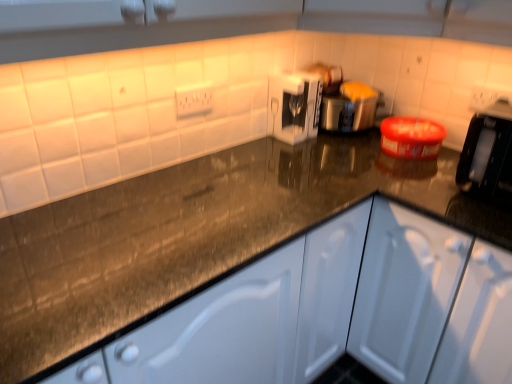
Identify the location of white matte cabinet at center. The width and height of the screenshot is (512, 384). (x=406, y=292).

What do you see at coordinates (350, 108) in the screenshot? I see `satin silver toaster at center, the second appliance in the left-to-right sequence` at bounding box center [350, 108].

Based on the photo, how much space does satin silver toaster at center, the second appliance in the left-to-right sequence, occupy vertically?

satin silver toaster at center, the second appliance in the left-to-right sequence, is 9.99 inches tall.

Find the location of a particular element. The width and height of the screenshot is (512, 384). white plastic electric outlet at upper center is located at coordinates (194, 99).

From a real-world perspective, which object rests below the other?

white matte cabinet at center, from a real-world perspective.

Is satin silver toaster at center, marked as the first appliance in a right-to-left arrangement, looking in the opposite direction of white matte cabinet at center?

No, satin silver toaster at center, marked as the first appliance in a right-to-left arrangement,'s orientation is not away from white matte cabinet at center.

Which object is positioned more to the left, satin silver toaster at center, marked as the first appliance in a right-to-left arrangement, or white matte cabinet at center?

satin silver toaster at center, marked as the first appliance in a right-to-left arrangement.

Would you say satin silver toaster at center, the second appliance in the left-to-right sequence, is inside or outside white matte cabinet at center?

satin silver toaster at center, the second appliance in the left-to-right sequence, cannot be found inside white matte cabinet at center.

Considering the relative positions of white glossy coffee machine at center, which appears as the first appliance when viewed from the left, and white plastic electric outlet at upper center in the image provided, is white glossy coffee machine at center, which appears as the first appliance when viewed from the left, to the right of white plastic electric outlet at upper center from the viewer's perspective?

Correct, you'll find white glossy coffee machine at center, which appears as the first appliance when viewed from the left, to the right of white plastic electric outlet at upper center.

Is white glossy coffee machine at center, which appears as the first appliance when viewed from the left, turned away from white plastic electric outlet at upper center?

No, white plastic electric outlet at upper center is not at the back of white glossy coffee machine at center, which appears as the first appliance when viewed from the left.

Is white glossy coffee machine at center, which appears as the first appliance when viewed from the left, positioned far away from white plastic electric outlet at upper center?

white glossy coffee machine at center, which appears as the first appliance when viewed from the left, is actually quite close to white plastic electric outlet at upper center.

Which object is further away from the camera taking this photo, white glossy coffee machine at center, placed as the second appliance when sorted from right to left, or white plastic electric outlet at upper center?

white glossy coffee machine at center, placed as the second appliance when sorted from right to left, is behind.

From the image's perspective, does white plastic electric outlet at upper center appear lower than white matte cabinet at center?

Incorrect, from the image's perspective, white plastic electric outlet at upper center is higher than white matte cabinet at center.

Does white plastic electric outlet at upper center have a smaller size compared to white matte cabinet at center?

Yes, white plastic electric outlet at upper center is smaller than white matte cabinet at center.

Is white plastic electric outlet at upper center taller or shorter than white matte cabinet at center?

white plastic electric outlet at upper center is shorter than white matte cabinet at center.

How many degrees apart are the facing directions of white plastic electric outlet at upper center and white matte cabinet at center?

87.6 degrees separate the facing orientations of white plastic electric outlet at upper center and white matte cabinet at center.

Does white matte cabinet at center have a smaller size compared to white plastic electric outlet at upper center?

No.

Is white matte cabinet at center to the left of white plastic electric outlet at upper center from the viewer's perspective?

Incorrect, white matte cabinet at center is not on the left side of white plastic electric outlet at upper center.

Is white matte cabinet at center not close to white plastic electric outlet at upper center?

No, white matte cabinet at center is not far from white plastic electric outlet at upper center.

From the image's perspective, who appears lower, white matte cabinet at center or white plastic electric outlet at upper center?

white matte cabinet at center, from the image's perspective.

Looking at this image, is white plastic electric outlet at upper center taller or shorter than white glossy coffee machine at center, which appears as the first appliance when viewed from the left?

white plastic electric outlet at upper center is shorter than white glossy coffee machine at center, which appears as the first appliance when viewed from the left.

Is white plastic electric outlet at upper center situated inside white glossy coffee machine at center, placed as the second appliance when sorted from right to left, or outside?

white plastic electric outlet at upper center cannot be found inside white glossy coffee machine at center, placed as the second appliance when sorted from right to left.

From the image's perspective, who appears lower, white plastic electric outlet at upper center or white glossy coffee machine at center, placed as the second appliance when sorted from right to left?

white plastic electric outlet at upper center.

Which point is more distant from viewer, (183, 111) or (301, 85)?

The point (301, 85) is behind.

From a real-world perspective, is white matte cabinet at center below white glossy coffee machine at center, placed as the second appliance when sorted from right to left?

Correct, in the physical world, white matte cabinet at center is lower than white glossy coffee machine at center, placed as the second appliance when sorted from right to left.

Between white matte cabinet at center and white glossy coffee machine at center, placed as the second appliance when sorted from right to left, which one is positioned behind?

white glossy coffee machine at center, placed as the second appliance when sorted from right to left, is further away from the camera.

Considering the relative sizes of white matte cabinet at center and white glossy coffee machine at center, placed as the second appliance when sorted from right to left, in the image provided, is white matte cabinet at center wider than white glossy coffee machine at center, placed as the second appliance when sorted from right to left,?

Indeed, white matte cabinet at center has a greater width compared to white glossy coffee machine at center, placed as the second appliance when sorted from right to left.

In terms of size, does satin silver toaster at center, marked as the first appliance in a right-to-left arrangement, appear bigger or smaller than white glossy coffee machine at center, placed as the second appliance when sorted from right to left?

satin silver toaster at center, marked as the first appliance in a right-to-left arrangement, is bigger than white glossy coffee machine at center, placed as the second appliance when sorted from right to left.

From the picture: Does satin silver toaster at center, marked as the first appliance in a right-to-left arrangement, have a lesser width compared to white glossy coffee machine at center, which appears as the first appliance when viewed from the left?

No, satin silver toaster at center, marked as the first appliance in a right-to-left arrangement, is not thinner than white glossy coffee machine at center, which appears as the first appliance when viewed from the left.

Is satin silver toaster at center, marked as the first appliance in a right-to-left arrangement, positioned far away from white glossy coffee machine at center, which appears as the first appliance when viewed from the left?

No, satin silver toaster at center, marked as the first appliance in a right-to-left arrangement, is not far from white glossy coffee machine at center, which appears as the first appliance when viewed from the left.

Measure the distance between satin silver toaster at center, marked as the first appliance in a right-to-left arrangement, and white glossy coffee machine at center, which appears as the first appliance when viewed from the left.

The distance of satin silver toaster at center, marked as the first appliance in a right-to-left arrangement, from white glossy coffee machine at center, which appears as the first appliance when viewed from the left, is 4.65 inches.

Starting from the white matte cabinet at center, which appliance is the 1st one to the left? Please provide its 2D coordinates.

[(350, 108)]

Where is `electric outlet above the white glossy coffee machine at center, which appears as the first appliance when viewed from the left (from a real-world perspective)`? Image resolution: width=512 pixels, height=384 pixels. electric outlet above the white glossy coffee machine at center, which appears as the first appliance when viewed from the left (from a real-world perspective) is located at coordinates (194, 99).

From the image, which object appears to be nearer to white glossy coffee machine at center, which appears as the first appliance when viewed from the left, white plastic electric outlet at upper center or satin silver toaster at center, marked as the first appliance in a right-to-left arrangement?

satin silver toaster at center, marked as the first appliance in a right-to-left arrangement, lies closer to white glossy coffee machine at center, which appears as the first appliance when viewed from the left, than the other object.

From the image, which object appears to be nearer to white matte cabinet at center, white plastic electric outlet at upper center or satin silver toaster at center, marked as the first appliance in a right-to-left arrangement?

satin silver toaster at center, marked as the first appliance in a right-to-left arrangement, is closer to white matte cabinet at center.

Looking at the image, which one is located closer to white plastic electric outlet at upper center, white glossy coffee machine at center, placed as the second appliance when sorted from right to left, or white matte cabinet at center?

white glossy coffee machine at center, placed as the second appliance when sorted from right to left, lies closer to white plastic electric outlet at upper center than the other object.

Estimate the real-world distances between objects in this image. Which object is closer to white glossy coffee machine at center, placed as the second appliance when sorted from right to left, white matte cabinet at center or satin silver toaster at center, the second appliance in the left-to-right sequence?

Among the two, satin silver toaster at center, the second appliance in the left-to-right sequence, is located nearer to white glossy coffee machine at center, placed as the second appliance when sorted from right to left.

Based on their spatial positions, is white plastic electric outlet at upper center or white glossy coffee machine at center, placed as the second appliance when sorted from right to left, further from white matte cabinet at center?

white plastic electric outlet at upper center is positioned further to the anchor white matte cabinet at center.

Estimate the real-world distances between objects in this image. Which object is further from white matte cabinet at center, satin silver toaster at center, marked as the first appliance in a right-to-left arrangement, or white plastic electric outlet at upper center?

Based on the image, white plastic electric outlet at upper center appears to be further to white matte cabinet at center.

In the scene shown: When comparing their distances from white plastic electric outlet at upper center, does satin silver toaster at center, the second appliance in the left-to-right sequence, or white glossy coffee machine at center, placed as the second appliance when sorted from right to left, seem closer?

The object closer to white plastic electric outlet at upper center is white glossy coffee machine at center, placed as the second appliance when sorted from right to left.

Based on their spatial positions, is white matte cabinet at center or satin silver toaster at center, the second appliance in the left-to-right sequence, closer to white plastic electric outlet at upper center?

satin silver toaster at center, the second appliance in the left-to-right sequence, lies closer to white plastic electric outlet at upper center than the other object.

In order to click on appliance between white plastic electric outlet at upper center and satin silver toaster at center, marked as the first appliance in a right-to-left arrangement, from left to right in this screenshot , I will do `click(295, 106)`.

Image resolution: width=512 pixels, height=384 pixels. In order to click on appliance between satin silver toaster at center, marked as the first appliance in a right-to-left arrangement, and white matte cabinet at center in the up-down direction in this screenshot , I will do click(x=295, y=106).